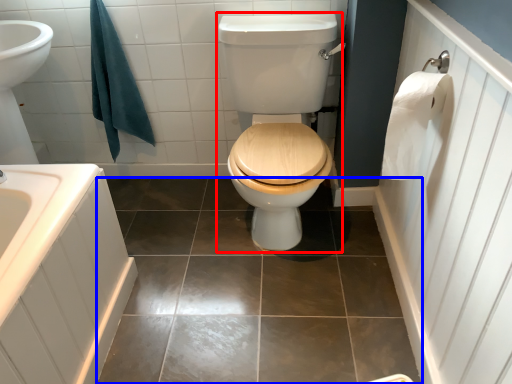
Question: Which object is further to the camera taking this photo, sit (highlighted by a red box) or ceramic tile (highlighted by a blue box)?

Choices:
 (A) sit
 (B) ceramic tile

Answer: (B)